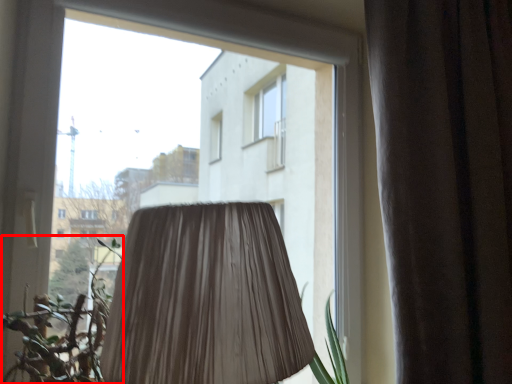
Question: From the image's perspective, what is the correct spatial relationship of vegetation (annotated by the red box) in relation to curtain?

Choices:
 (A) below
 (B) above

Answer: (A)